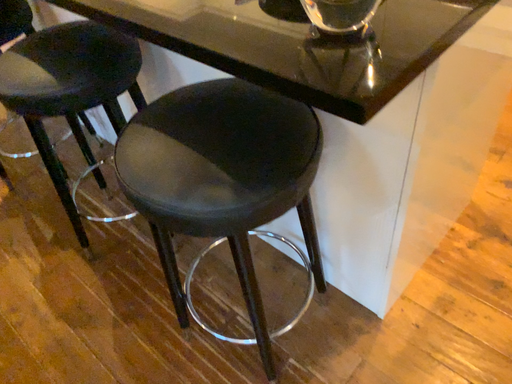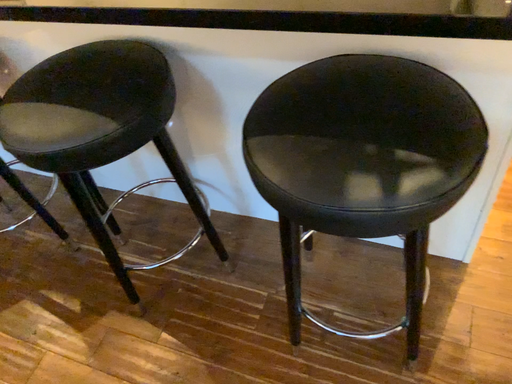
Question: Which way did the camera rotate in the video?

Choices:
 (A) rotated left
 (B) rotated right

Answer: (B)